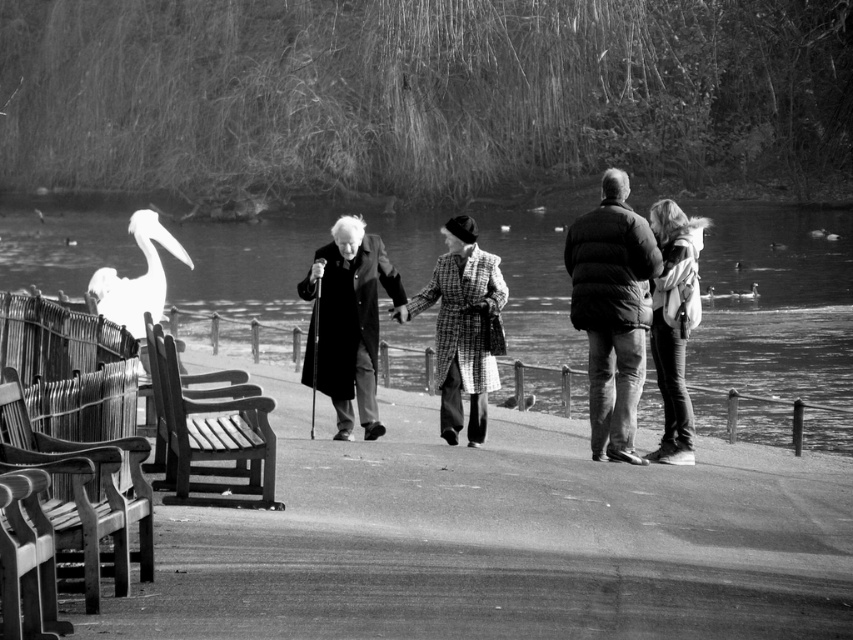
From the picture: Is smooth water at center closer to camera compared to wooden park bench at lower left?

No, it is not.

Can you confirm if smooth water at center is positioned above wooden park bench at lower left?

Yes.

Where is `smooth water at center`? This screenshot has width=853, height=640. smooth water at center is located at coordinates (775, 323).

The height and width of the screenshot is (640, 853). I want to click on smooth water at center, so (x=775, y=323).

Between wooden park bench at lower left and checkered wool coat at center, which one has less height?

wooden park bench at lower left

You are a GUI agent. You are given a task and a screenshot of the screen. Output one action in this format:
    pyautogui.click(x=<x>, y=<y>)
    Task: Click on the wooden park bench at lower left
    This screenshot has height=640, width=853.
    Given the screenshot: What is the action you would take?
    pyautogui.click(x=83, y=496)

Locate an element on the screen. Image resolution: width=853 pixels, height=640 pixels. wooden park bench at lower left is located at coordinates (83, 496).

Who is more distant from viewer, (601, 189) or (695, 317)?

The point (601, 189) is more distant.

This screenshot has width=853, height=640. Find the location of `matte black jacket at center`. matte black jacket at center is located at coordinates (612, 310).

In order to click on matte black jacket at center in this screenshot , I will do `click(612, 310)`.